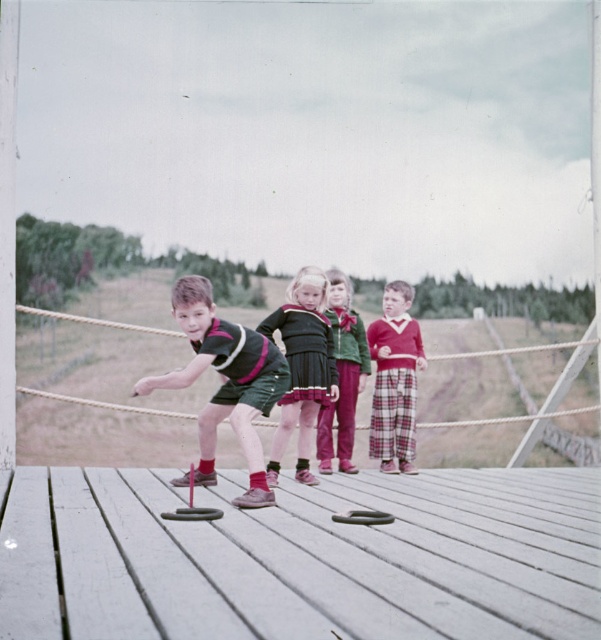
Question: Which object is positioned farthest from the wooden at center?

Choices:
 (A) matte black dress at center
 (B) matte green shorts at center
 (C) velvet green sweater at center
 (D) plaid fabric pants at center

Answer: (D)

Question: Among these objects, which one is nearest to the camera?

Choices:
 (A) plaid fabric pants at center
 (B) velvet green sweater at center

Answer: (B)

Question: Does matte black dress at center have a greater width compared to velvet green sweater at center?

Choices:
 (A) no
 (B) yes

Answer: (B)

Question: Does wooden at center lie in front of plaid fabric pants at center?

Choices:
 (A) yes
 (B) no

Answer: (A)

Question: Estimate the real-world distances between objects in this image. Which object is farther from the velvet green sweater at center?

Choices:
 (A) wooden at center
 (B) matte green shorts at center

Answer: (A)

Question: Can you confirm if matte black dress at center is positioned below velvet green sweater at center?

Choices:
 (A) no
 (B) yes

Answer: (B)